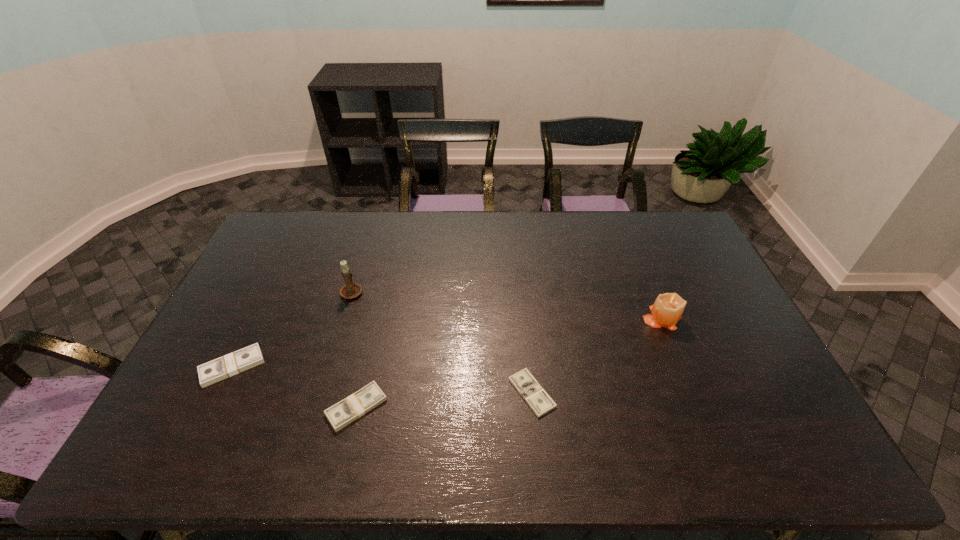
At what (x,y) coordinates should I click in order to perform the action: click on candle holder. Please return your answer as a coordinate pair (x, y). The width and height of the screenshot is (960, 540). Looking at the image, I should click on tap(351, 290).

Where is `the tallest object`? the tallest object is located at coordinates (351, 290).

This screenshot has height=540, width=960. Find the location of `the rightmost object`. the rightmost object is located at coordinates (667, 310).

Locate an element on the screen. Image resolution: width=960 pixels, height=540 pixels. the fourth nearest object is located at coordinates (667, 310).

Locate an element on the screen. the leftmost object is located at coordinates (236, 362).

At what (x,y) coordinates should I click in order to perform the action: click on the second dollar from right to left. Please return your answer as a coordinate pair (x, y). Looking at the image, I should click on (343, 413).

At what (x,y) coordinates should I click in order to perform the action: click on the shortest object. Please return your answer as a coordinate pair (x, y). Looking at the image, I should click on (539, 401).

Identify the location of the rightmost dollar. (539, 401).

Image resolution: width=960 pixels, height=540 pixels. Find the location of `vacant area located on the side of the candle holder with the handle`. vacant area located on the side of the candle holder with the handle is located at coordinates (372, 223).

Where is `vacant space located 0.330m on the side of the candle holder with the handle`? Image resolution: width=960 pixels, height=540 pixels. vacant space located 0.330m on the side of the candle holder with the handle is located at coordinates (372, 223).